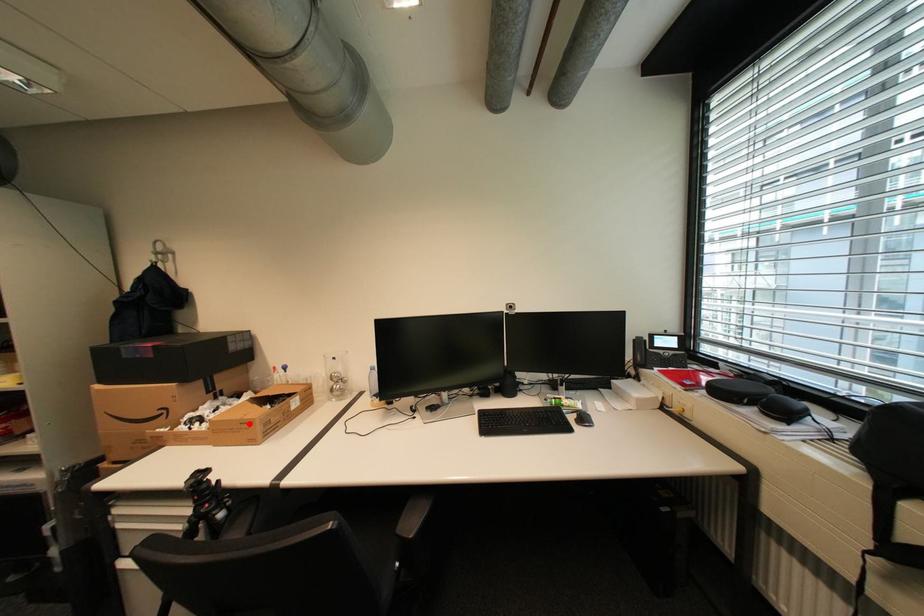
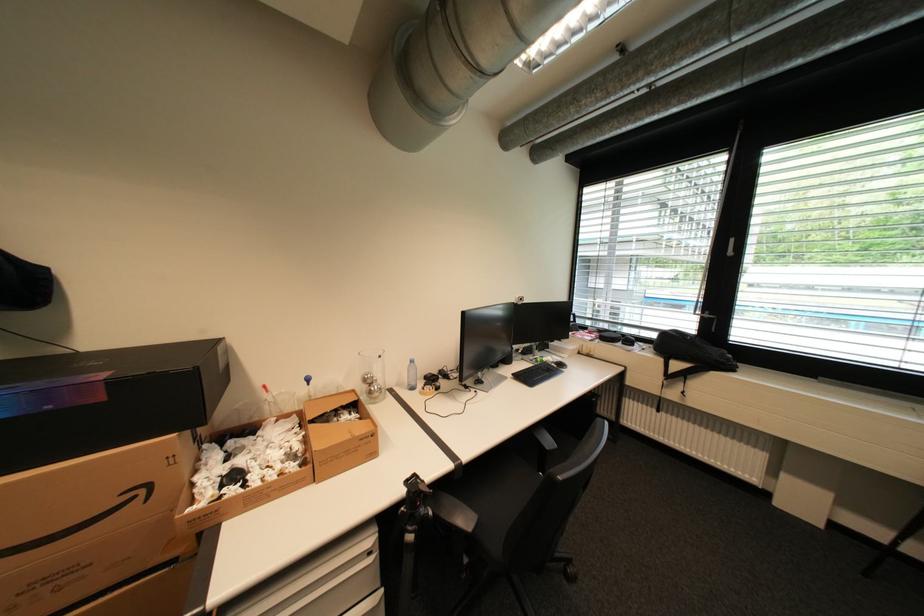
Where in the second image is the point corresponding to the highlighted location from the first image?

(370, 440)